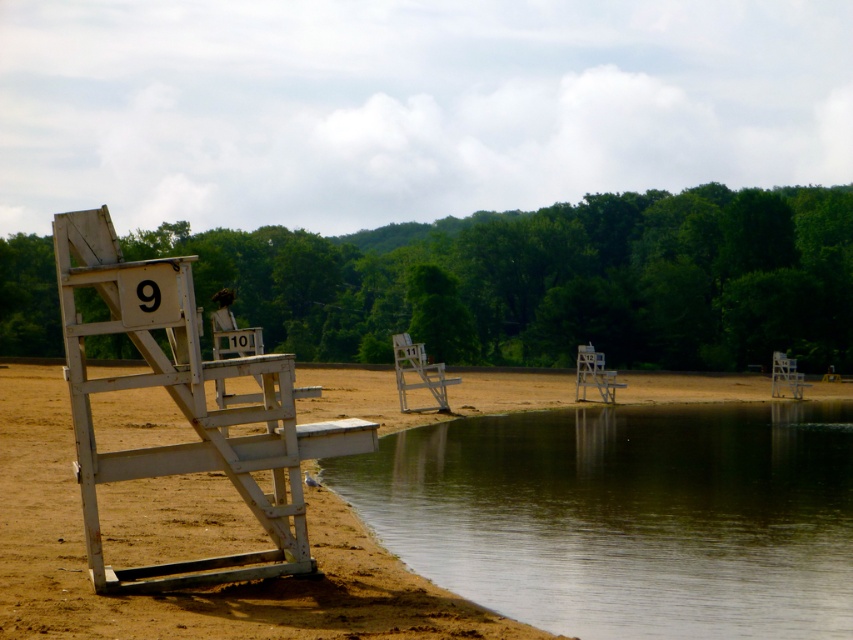
Question: Is the position of white wooden lifeguard chair at left more distant than that of white wood chair at center?

Choices:
 (A) no
 (B) yes

Answer: (A)

Question: Estimate the real-world distances between objects in this image. Which object is closer to the wooden lifeguard chair at center?

Choices:
 (A) white wood chair at center
 (B) white wooden lifeguard chair at left
 (C) brown sandy beach at lower left
 (D) clear water at lower center

Answer: (A)

Question: Which is nearer to the wooden lifeguard chair at center?

Choices:
 (A) white wood chair at center
 (B) white wooden lifeguard chair at left

Answer: (A)

Question: Which is nearer to the wooden lifeguard chair at center?

Choices:
 (A) white wood chair at center
 (B) clear water at lower center
 (C) brown sandy beach at lower left
 (D) white wooden lifeguard chair at left

Answer: (A)

Question: Is clear water at lower center smaller than white plastic chair at right?

Choices:
 (A) no
 (B) yes

Answer: (A)

Question: Does clear water at lower center lie behind brown sandy beach at lower left?

Choices:
 (A) yes
 (B) no

Answer: (A)